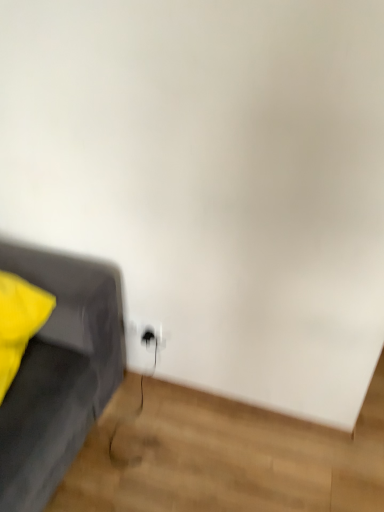
What do you see at coordinates (19, 322) in the screenshot? I see `matte yellow pillow at left` at bounding box center [19, 322].

Where is `matte yellow pillow at left`? This screenshot has height=512, width=384. matte yellow pillow at left is located at coordinates (19, 322).

The height and width of the screenshot is (512, 384). Identify the location of matte yellow pillow at left. 19,322.